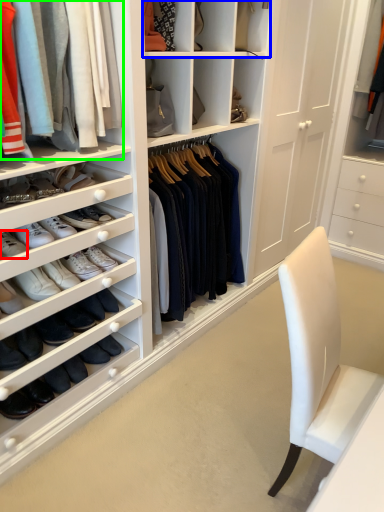
Question: Considering the real-world distances, which object is farthest from footwear (highlighted by a red box)? shelf (highlighted by a blue box) or clothing (highlighted by a green box)?

Choices:
 (A) shelf
 (B) clothing

Answer: (A)